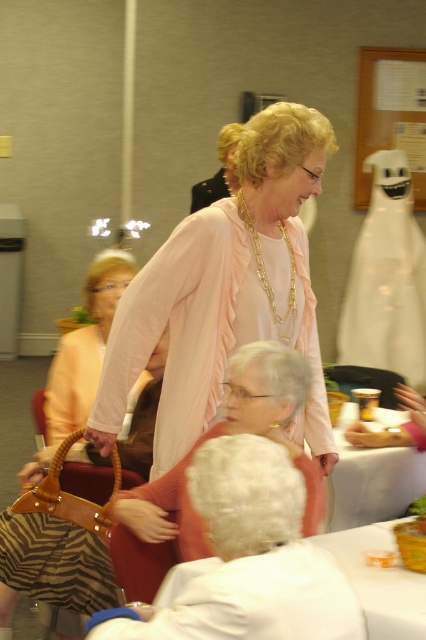
Is white fabric ghost at upper right in front of matte pink sweater at center?

No, white fabric ghost at upper right is further to the viewer.

Who is shorter, white fabric ghost at upper right or matte pink sweater at center?

With less height is matte pink sweater at center.

The width and height of the screenshot is (426, 640). Find the location of `white fabric ghost at upper right`. white fabric ghost at upper right is located at coordinates (386, 278).

At what (x,y) coordinates should I click in order to perform the action: click on white fabric ghost at upper right. Please return your answer as a coordinate pair (x, y). Looking at the image, I should click on (386, 278).

Who is higher up, white matte jacket at upper center or gold chain necklace at center?

gold chain necklace at center

Is white matte jacket at upper center below gold chain necklace at center?

Yes, white matte jacket at upper center is below gold chain necklace at center.

The height and width of the screenshot is (640, 426). Find the location of `white matte jacket at upper center`. white matte jacket at upper center is located at coordinates (249, 557).

Identify the location of white matte jacket at upper center. 249,557.

Can you confirm if matte pink cardigan at center is smaller than gold chain necklace at center?

Incorrect, matte pink cardigan at center is not smaller in size than gold chain necklace at center.

Does matte pink cardigan at center appear on the right side of gold chain necklace at center?

No, matte pink cardigan at center is not to the right of gold chain necklace at center.

Who is more distant from viewer, (215,324) or (291,273)?

The point (291,273) is more distant.

Locate an element on the screen. matte pink cardigan at center is located at coordinates (226, 292).